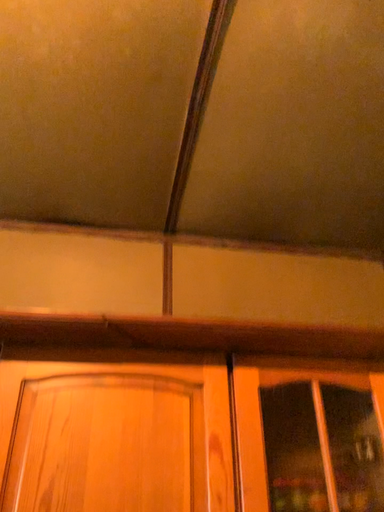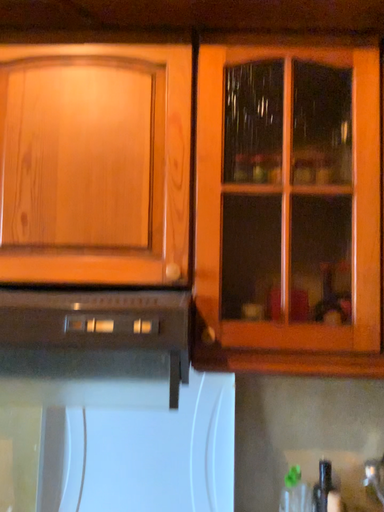
Question: Which way did the camera rotate in the video?

Choices:
 (A) rotated left
 (B) rotated right

Answer: (A)